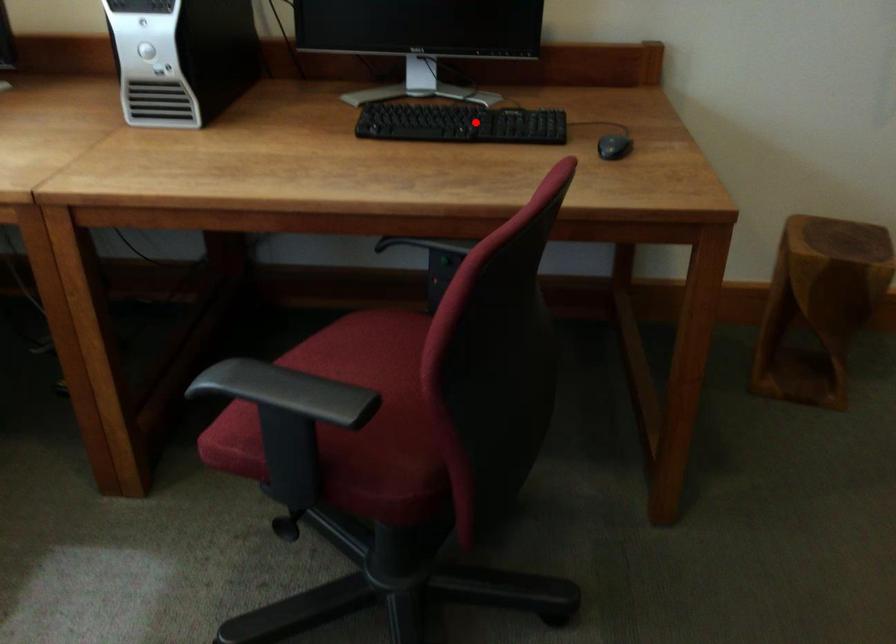
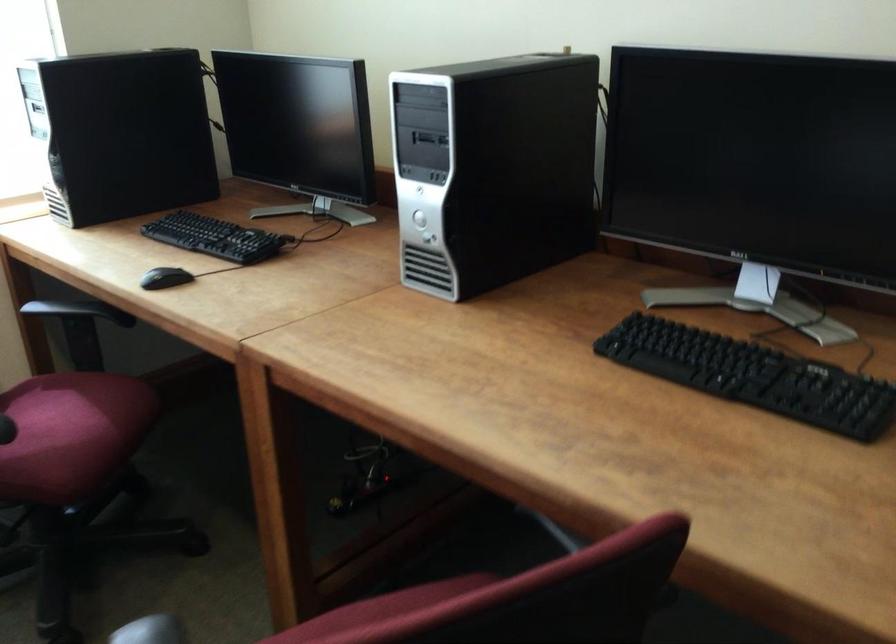
Question: I am providing you with two images of the same scene from different viewpoints. In image1, a red point is highlighted. Considering the same 3D point in image2, which of the following is correct?

Choices:
 (A) It is closer
 (B) It is farther

Answer: (A)